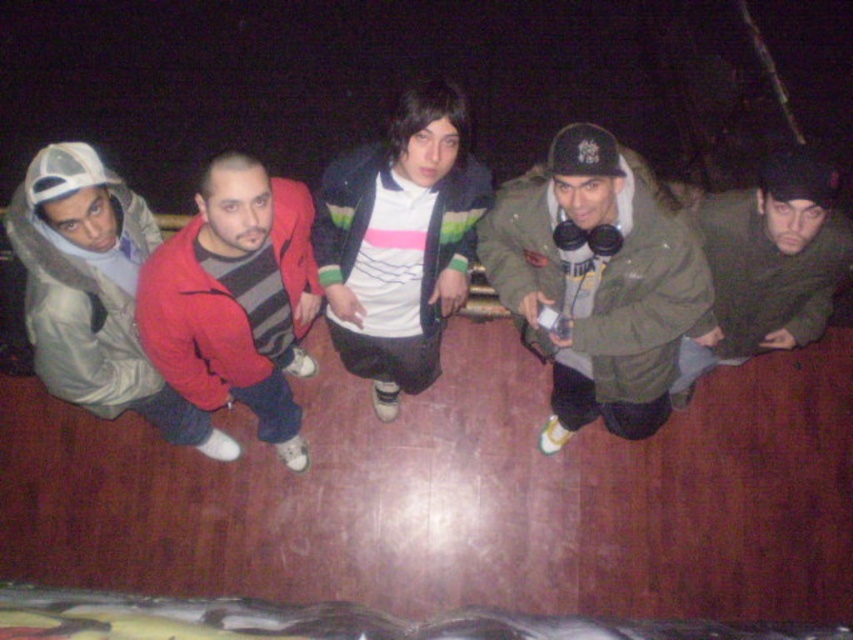
From the picture: You are a photographer trying to capture a group photo of the green matte jacket at center and the red matte sweater at center. Since you want to ensure both are clearly visible, which one should you focus on first considering their sizes?

The green matte jacket at center is bigger than the red matte sweater at center, so you should focus on the green matte jacket at center first to ensure it is clearly visible.

You are standing in front of the group of five people on the wooden platform. You notice two points marked on the platform. The first point is at coordinates point (650, 310) and the second is at point (344, 259). Which point is nearer to you?

Point (650, 310) is closer to the viewer than point (344, 259).

Looking at this image, you are a photographer trying to adjust the lighting for a group photo. You notice the green matte jacket at center and the white striped shirt at center. Which one is closer to the camera?

The green matte jacket at center is in front of the white striped shirt at center, so it is closer to the camera.